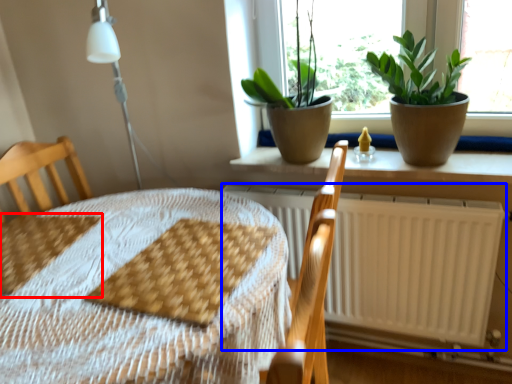
Question: Among these objects, which one is nearest to the camera, sheet (highlighted by a red box) or radiator (highlighted by a blue box)?

Choices:
 (A) sheet
 (B) radiator

Answer: (A)